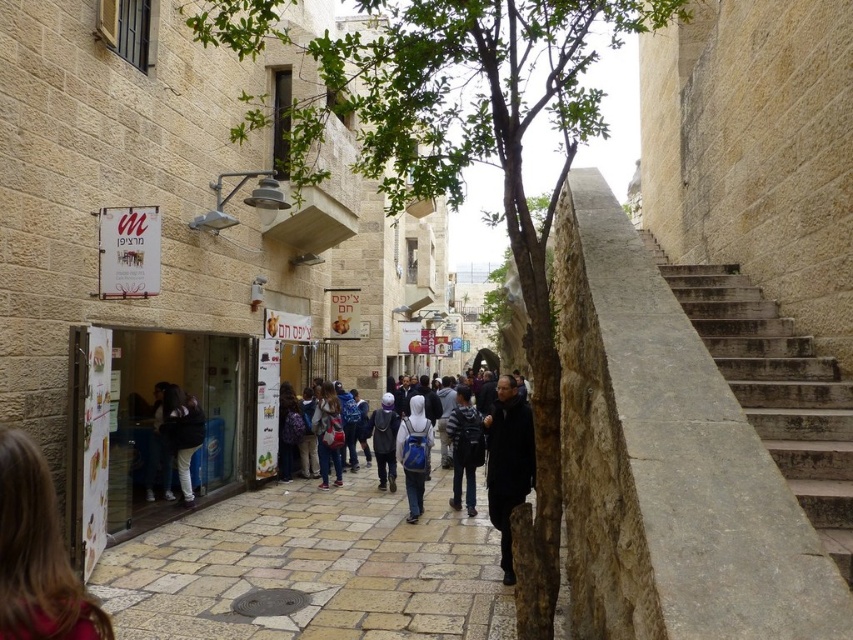
You are a tourist carrying a blue backpack at center and want to place it on the light beige stone pavement at center. Will the backpack fit on the pavement?

The light beige stone pavement at center is shorter than the blue backpack at center, so the backpack will not fit on the pavement.